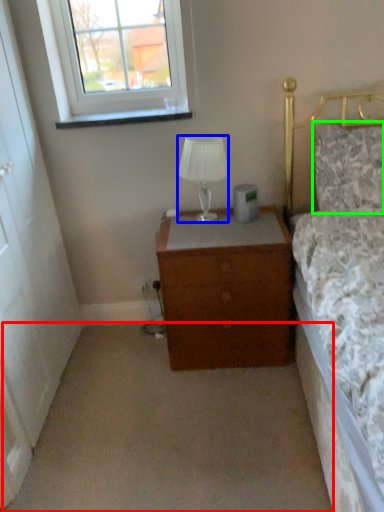
Question: Which object is the closest to the plain (highlighted by a red box)? Choose among these: lamp (highlighted by a blue box) or pillow (highlighted by a green box).

Choices:
 (A) lamp
 (B) pillow

Answer: (A)